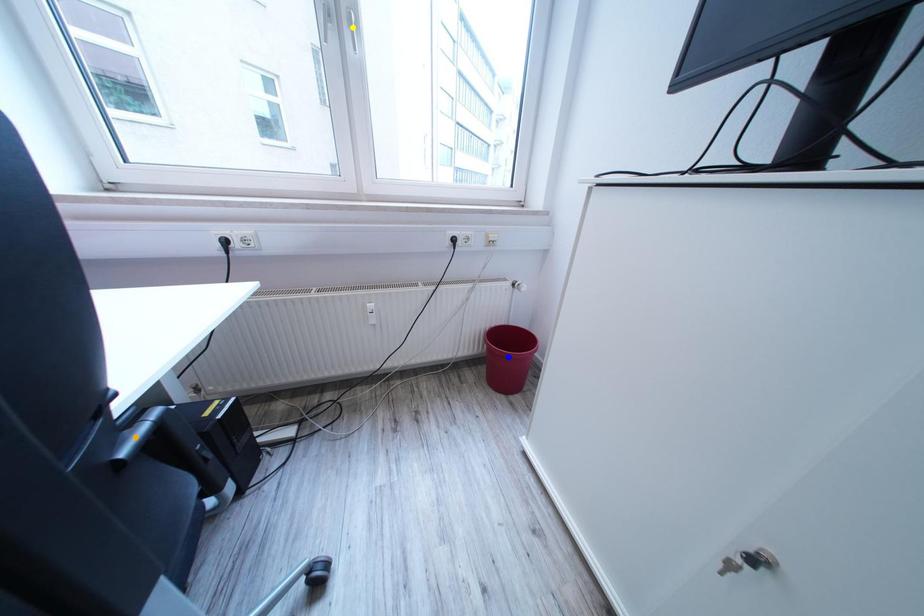
Order these from farthest to nearest:
- yellow point
- blue point
- orange point

1. blue point
2. yellow point
3. orange point